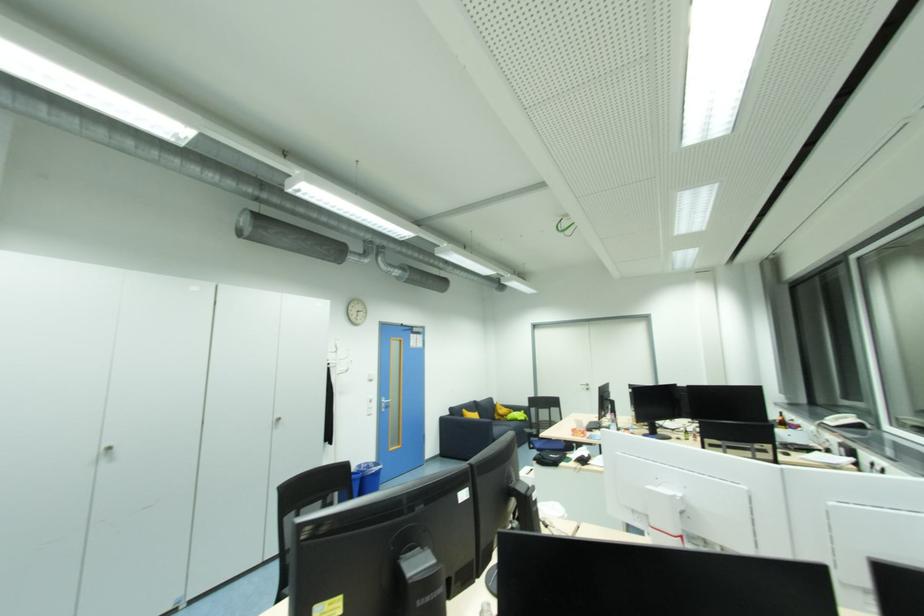
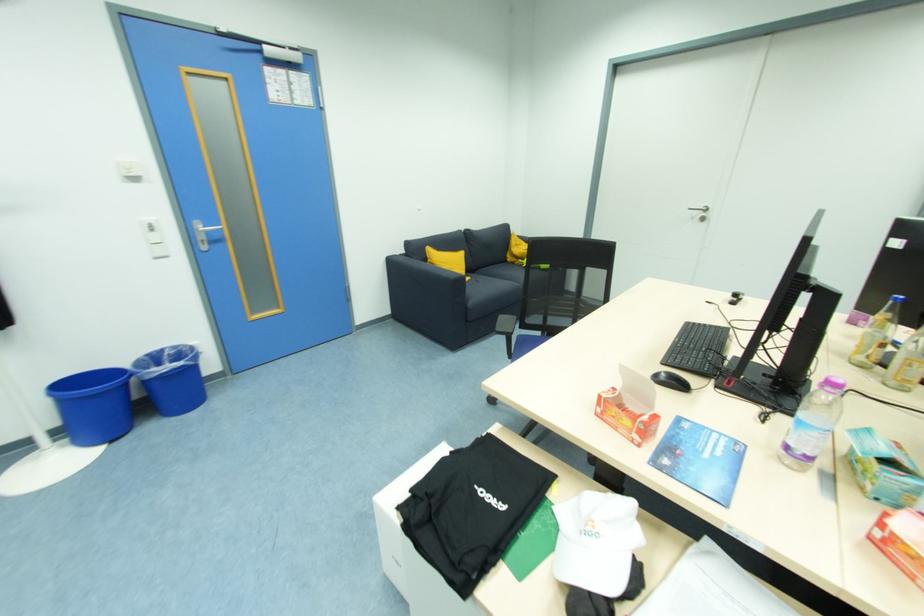
Locate, in the second image, the point that corresponds to point (386, 411) in the first image.

(208, 249)